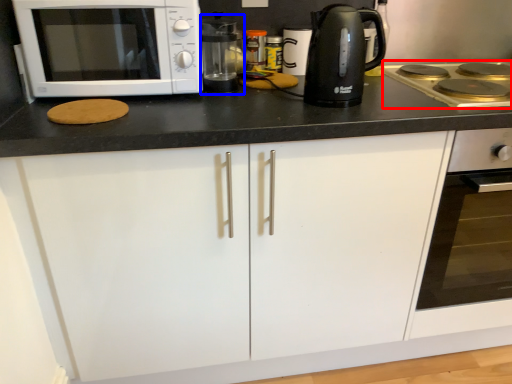
Question: Which of the following is the closest to the observer, gas stove (highlighted by a red box) or coffee machine (highlighted by a blue box)?

Choices:
 (A) gas stove
 (B) coffee machine

Answer: (A)